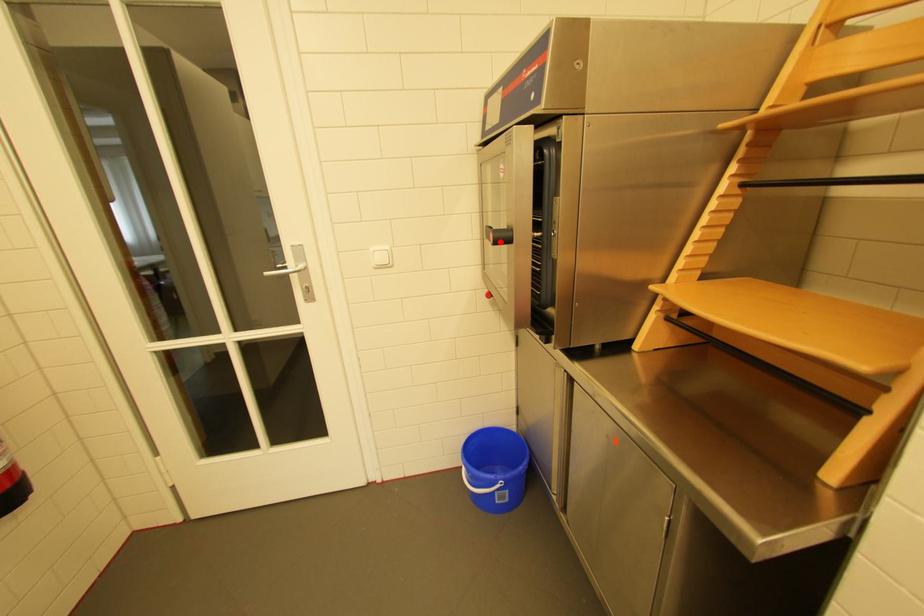
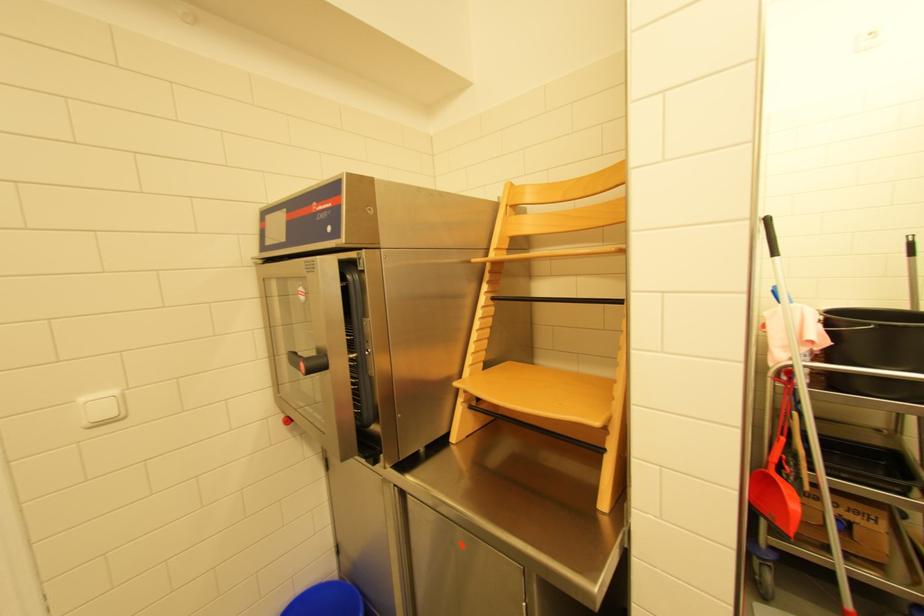
Question: I am providing you with two images of the same scene from different viewpoints. Given a red point in image1, look at the same physical point in image2. Is it:

Choices:
 (A) Closer to the viewpoint
 (B) Farther from the viewpoint

Answer: (B)